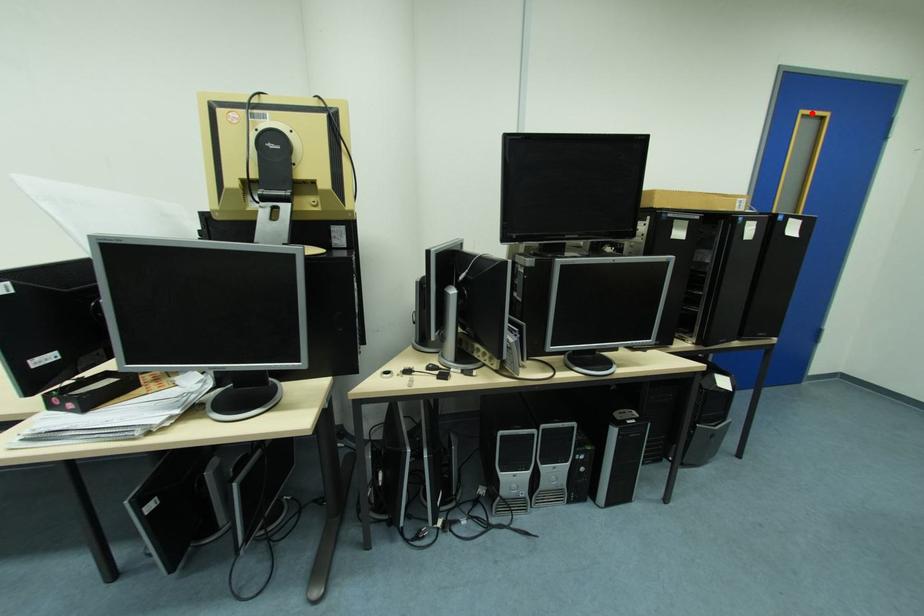
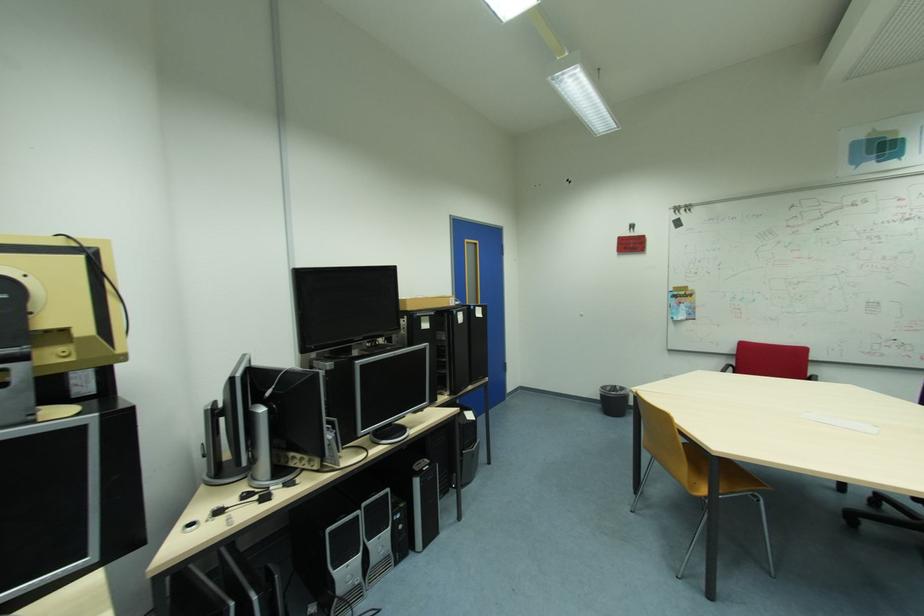
Question: I am providing you with two images of the same scene from different viewpoints. A red point is shown in image1. For the corresponding object point in image2, is it positioned nearer or farther from the camera?

Choices:
 (A) Nearer
 (B) Farther

Answer: (A)